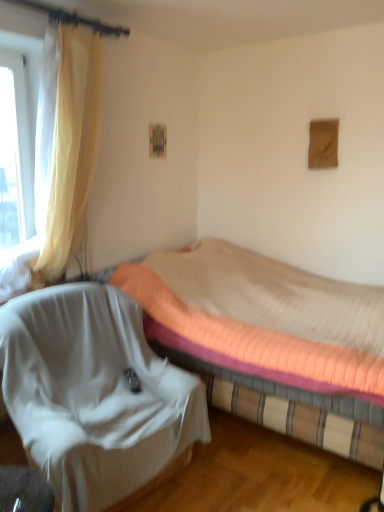
Question: From a real-world perspective, is white fabric chair at lower left physically below transparent glass window at left?

Choices:
 (A) yes
 (B) no

Answer: (A)

Question: Is white fabric chair at lower left far away from transparent glass window at left?

Choices:
 (A) no
 (B) yes

Answer: (B)

Question: Is white fabric chair at lower left oriented towards transparent glass window at left?

Choices:
 (A) yes
 (B) no

Answer: (B)

Question: Is white fabric chair at lower left at the right side of transparent glass window at left?

Choices:
 (A) no
 (B) yes

Answer: (B)

Question: Does white fabric chair at lower left have a greater height compared to transparent glass window at left?

Choices:
 (A) no
 (B) yes

Answer: (A)

Question: Is white fabric chair at lower left smaller than transparent glass window at left?

Choices:
 (A) no
 (B) yes

Answer: (A)

Question: Is white fabric chair at lower left closer to the viewer compared to pink quilted mattress at center?

Choices:
 (A) yes
 (B) no

Answer: (A)

Question: Is pink quilted mattress at center inside white fabric chair at lower left?

Choices:
 (A) no
 (B) yes

Answer: (A)

Question: From a real-world perspective, is white fabric chair at lower left below pink quilted mattress at center?

Choices:
 (A) no
 (B) yes

Answer: (B)

Question: Is white fabric chair at lower left bigger than pink quilted mattress at center?

Choices:
 (A) no
 (B) yes

Answer: (A)

Question: From the image's perspective, would you say white fabric chair at lower left is positioned over pink quilted mattress at center?

Choices:
 (A) no
 (B) yes

Answer: (A)

Question: Does white fabric chair at lower left have a smaller size compared to pink quilted mattress at center?

Choices:
 (A) no
 (B) yes

Answer: (B)

Question: Could yellow sheer curtain at left be considered to be inside transparent glass window at left?

Choices:
 (A) yes
 (B) no

Answer: (B)